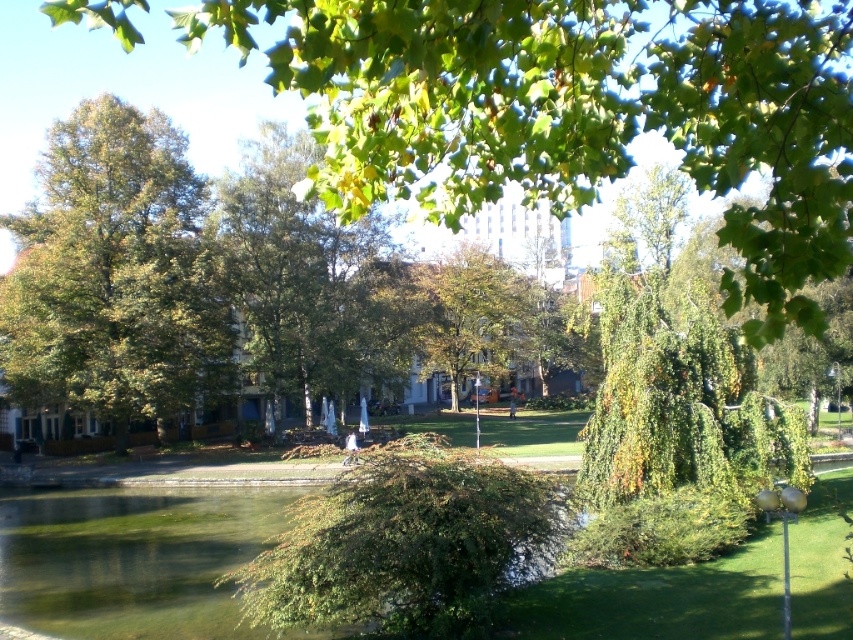
You are planning to set up a picnic blanket in the park. You want to ensure you have enough shade during the day. Which object from the scene can provide more shade, the green leafy tree at upper center or the green translucent water at lower left?

The green leafy tree at upper center is much taller than the green translucent water at lower left, so it provides more shade.